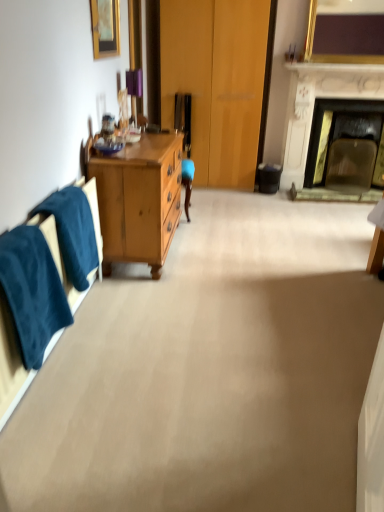
At what (x,y) coordinates should I click in order to perform the action: click on white marble fireplace at upper right. Please return your answer as a coordinate pair (x, y). This screenshot has height=512, width=384. Looking at the image, I should click on (314, 102).

Locate an element on the screen. This screenshot has width=384, height=512. gold metallic picture frame at upper right, the first picture frame in the right-to-left sequence is located at coordinates (344, 38).

Identify the location of black plastic trash can at lower right. The height and width of the screenshot is (512, 384). (268, 178).

The image size is (384, 512). What are the coordinates of `white marble fireplace at upper right` in the screenshot? It's located at (314, 102).

Is gold metallic picture frame at upper right, which is counted as the second picture frame, starting from the bottom, bigger than gold-framed picture at upper left, the first picture frame from the bottom?

Correct, gold metallic picture frame at upper right, which is counted as the second picture frame, starting from the bottom, is larger in size than gold-framed picture at upper left, the first picture frame from the bottom.

Which object is closer to the camera, gold metallic picture frame at upper right, which is counted as the second picture frame, starting from the bottom, or gold-framed picture at upper left, which ranks as the second picture frame in right-to-left order?

gold-framed picture at upper left, which ranks as the second picture frame in right-to-left order, is closer to the camera.

Which object is thinner, gold metallic picture frame at upper right, the first picture frame in the right-to-left sequence, or gold-framed picture at upper left, the 1th picture frame from the left?

With smaller width is gold-framed picture at upper left, the 1th picture frame from the left.

At what (x,y) coordinates should I click in order to perform the action: click on picture frame on the right of gold-framed picture at upper left, which is counted as the 1th picture frame, starting from the front. Please return your answer as a coordinate pair (x, y). The height and width of the screenshot is (512, 384). Looking at the image, I should click on (344, 38).

Is gold metallic picture frame at upper right, which is counted as the second picture frame, starting from the bottom, to the left of velvety blue towel at left, the 2th towel/napkin viewed from the back, from the viewer's perspective?

In fact, gold metallic picture frame at upper right, which is counted as the second picture frame, starting from the bottom, is to the right of velvety blue towel at left, the 2th towel/napkin viewed from the back.

Is gold metallic picture frame at upper right, the first picture frame in the right-to-left sequence, outside of velvety blue towel at left, the 2th towel/napkin viewed from the back?

That's correct, gold metallic picture frame at upper right, the first picture frame in the right-to-left sequence, is outside of velvety blue towel at left, the 2th towel/napkin viewed from the back.

Is gold-framed picture at upper left, marked as the second picture frame in a top-to-bottom arrangement, positioned beyond the bounds of velvety blue towel at left, the 2th towel/napkin viewed from the back?

Yes.

You are a GUI agent. You are given a task and a screenshot of the screen. Output one action in this format:
    pyautogui.click(x=<x>, y=<y>)
    Task: Click on the picture frame that is the 1st one above the velvety blue towel at left, the first towel/napkin when ordered from front to back (from a real-world perspective)
    
    Given the screenshot: What is the action you would take?
    pyautogui.click(x=105, y=28)

Does point (108, 35) appear closer or farther from the camera than point (0, 252)?

Point (108, 35).

In the scene shown: From a real-world perspective, is velvety blue towel at left, the 2th towel/napkin viewed from the back, above or below white marble fireplace at upper right?

velvety blue towel at left, the 2th towel/napkin viewed from the back, is situated lower than white marble fireplace at upper right in the real world.

Considering the sizes of velvety blue towel at left, the first towel/napkin when ordered from front to back, and white marble fireplace at upper right in the image, is velvety blue towel at left, the first towel/napkin when ordered from front to back, wider or thinner than white marble fireplace at upper right?

velvety blue towel at left, the first towel/napkin when ordered from front to back, is thinner than white marble fireplace at upper right.

Does velvety blue towel at left, the 2th towel/napkin viewed from the back, appear on the right side of white marble fireplace at upper right?

No, velvety blue towel at left, the 2th towel/napkin viewed from the back, is not to the right of white marble fireplace at upper right.

Which is closer, (312, 74) or (47, 293)?

The point (47, 293) is more forward.

From the picture: Is white marble fireplace at upper right looking in the opposite direction of velvety blue towel at left, the first towel/napkin when ordered from front to back?

No, white marble fireplace at upper right is not facing the opposite direction of velvety blue towel at left, the first towel/napkin when ordered from front to back.

In terms of height, does white marble fireplace at upper right look taller or shorter compared to velvety blue towel at left, the 2th towel/napkin viewed from the back?

In the image, white marble fireplace at upper right appears to be taller than velvety blue towel at left, the 2th towel/napkin viewed from the back.

Which is in front, white marble fireplace at upper right or gold-framed picture at upper left, marked as the second picture frame in a back-to-front arrangement?

gold-framed picture at upper left, marked as the second picture frame in a back-to-front arrangement.

Is white marble fireplace at upper right facing towards gold-framed picture at upper left, the first picture frame from the bottom?

No, white marble fireplace at upper right is not turned towards gold-framed picture at upper left, the first picture frame from the bottom.

Between white marble fireplace at upper right and gold-framed picture at upper left, marked as the second picture frame in a back-to-front arrangement, which one has larger size?

With larger size is white marble fireplace at upper right.

From a real-world perspective, relative to gold-framed picture at upper left, the first picture frame from the bottom, is white marble fireplace at upper right vertically above or below?

From a real-world perspective, white marble fireplace at upper right is physically below gold-framed picture at upper left, the first picture frame from the bottom.

Considering the relative positions of gold metallic picture frame at upper right, which is counted as the second picture frame, starting from the bottom, and white marble fireplace at upper right in the image provided, is gold metallic picture frame at upper right, which is counted as the second picture frame, starting from the bottom, in front of white marble fireplace at upper right?

Yes, the depth of gold metallic picture frame at upper right, which is counted as the second picture frame, starting from the bottom, is less than that of white marble fireplace at upper right.

Considering the relative positions of gold metallic picture frame at upper right, the 2th picture frame in the front-to-back sequence, and white marble fireplace at upper right in the image provided, is gold metallic picture frame at upper right, the 2th picture frame in the front-to-back sequence, to the left or to the right of white marble fireplace at upper right?

→ gold metallic picture frame at upper right, the 2th picture frame in the front-to-back sequence, is positioned on white marble fireplace at upper right's left side.

Looking at this image, is white marble fireplace at upper right at the back of gold metallic picture frame at upper right, which is counted as the second picture frame, starting from the bottom?

No, gold metallic picture frame at upper right, which is counted as the second picture frame, starting from the bottom, is not facing away from white marble fireplace at upper right.

Identify the location of picture frame below the gold metallic picture frame at upper right, the 2th picture frame in the front-to-back sequence (from the image's perspective). (105, 28).

This screenshot has width=384, height=512. I want to click on the 2nd picture frame counting from the right of the velvety blue towel at left, the first towel/napkin when ordered from front to back, so click(x=344, y=38).

In the scene shown: When comparing their distances from velvety blue towel at left, the 2th towel/napkin viewed from the back, does white marble fireplace at upper right or blue fabric towel at left, the first towel/napkin positioned from the back, seem further?

white marble fireplace at upper right lies further to velvety blue towel at left, the 2th towel/napkin viewed from the back, than the other object.

Estimate the real-world distances between objects in this image. Which object is closer to black plastic trash can at lower right, white marble fireplace at upper right or blue fabric towel at left, the second towel/napkin positioned from the front?

white marble fireplace at upper right.

Which object lies nearer to the anchor point blue fabric towel at left, the second towel/napkin positioned from the front, velvety blue towel at left, the first towel/napkin when ordered from front to back, or gold-framed picture at upper left, which is counted as the 1th picture frame, starting from the front?

The object closer to blue fabric towel at left, the second towel/napkin positioned from the front, is velvety blue towel at left, the first towel/napkin when ordered from front to back.

Looking at the image, which one is located further to gold metallic picture frame at upper right, the 2th picture frame in the front-to-back sequence, gold-framed picture at upper left, which ranks as the second picture frame in right-to-left order, or velvety blue towel at left, the 2th towel/napkin viewed from the back?

velvety blue towel at left, the 2th towel/napkin viewed from the back, lies further to gold metallic picture frame at upper right, the 2th picture frame in the front-to-back sequence, than the other object.

From the image, which object appears to be farther from blue fabric towel at left, the first towel/napkin positioned from the back, black plastic trash can at lower right or gold metallic picture frame at upper right, arranged as the 1th picture frame when viewed from the back?

The object further to blue fabric towel at left, the first towel/napkin positioned from the back, is gold metallic picture frame at upper right, arranged as the 1th picture frame when viewed from the back.

Based on their spatial positions, is blue fabric towel at left, the second towel/napkin positioned from the front, or gold-framed picture at upper left, the 1th picture frame from the left, closer to white marble fireplace at upper right?

gold-framed picture at upper left, the 1th picture frame from the left, lies closer to white marble fireplace at upper right than the other object.

Estimate the real-world distances between objects in this image. Which object is further from white marble fireplace at upper right, gold-framed picture at upper left, the 1th picture frame from the left, or velvety blue towel at left, the first towel/napkin when ordered from front to back?

The object further to white marble fireplace at upper right is velvety blue towel at left, the first towel/napkin when ordered from front to back.

Looking at the image, which one is located closer to velvety blue towel at left, the 2th towel/napkin viewed from the back, gold-framed picture at upper left, which is counted as the 1th picture frame, starting from the front, or black plastic trash can at lower right?

The object closer to velvety blue towel at left, the 2th towel/napkin viewed from the back, is gold-framed picture at upper left, which is counted as the 1th picture frame, starting from the front.

I want to click on fireplace between blue fabric towel at left, the first towel/napkin positioned from the back, and black plastic trash can at lower right in the front-back direction, so click(x=314, y=102).

Locate an element on the screen. This screenshot has height=512, width=384. towel/napkin positioned between velvety blue towel at left, the first towel/napkin when ordered from front to back, and black plastic trash can at lower right from near to far is located at coordinates (73, 232).

Locate an element on the screen. Image resolution: width=384 pixels, height=512 pixels. towel/napkin between gold-framed picture at upper left, the first picture frame from the bottom, and velvety blue towel at left, the 2th towel/napkin viewed from the back, from top to bottom is located at coordinates (73, 232).

Identify the location of picture frame situated between gold-framed picture at upper left, which ranks as the second picture frame in right-to-left order, and white marble fireplace at upper right from left to right. (344, 38).